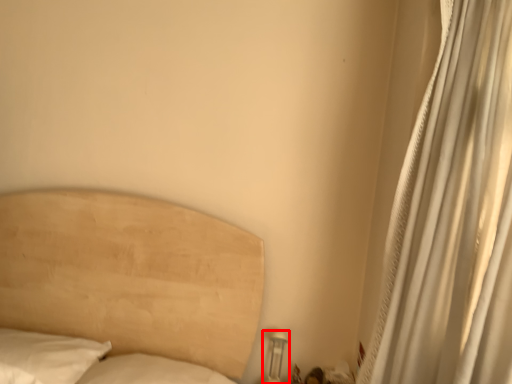
Question: From the image, what is the correct spatial relationship of table lamp (annotated by the red box) in relation to curtain?

Choices:
 (A) left
 (B) right

Answer: (A)